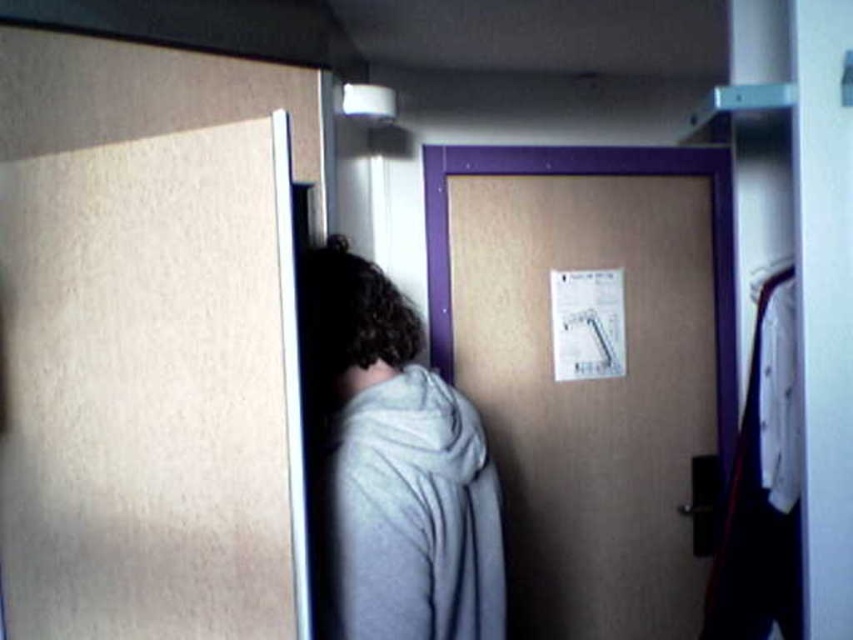
Based on the photo, you are standing in a room and see both the gray fleece robe at center and the wooden door at center. Which object is nearer to you?

The gray fleece robe at center is closer to the viewer than the wooden door at center.

You are trying to determine if you can fit through a narrow gap between two objects in the room. The gray fleece robe at center and the wooden door at center are both in your way. Which object is narrower, making it easier to navigate around?

The gray fleece robe at center is thinner than the wooden door at center, so it is narrower and easier to navigate around.

Looking at this image, you are trying to exit the room through the wooden door at center. There is a gray fleece robe at center in your way. Can you move around the robe to reach the door?

The gray fleece robe at center occupies less space than the wooden door at center, so yes, you can move around the robe to reach the wooden door at center.